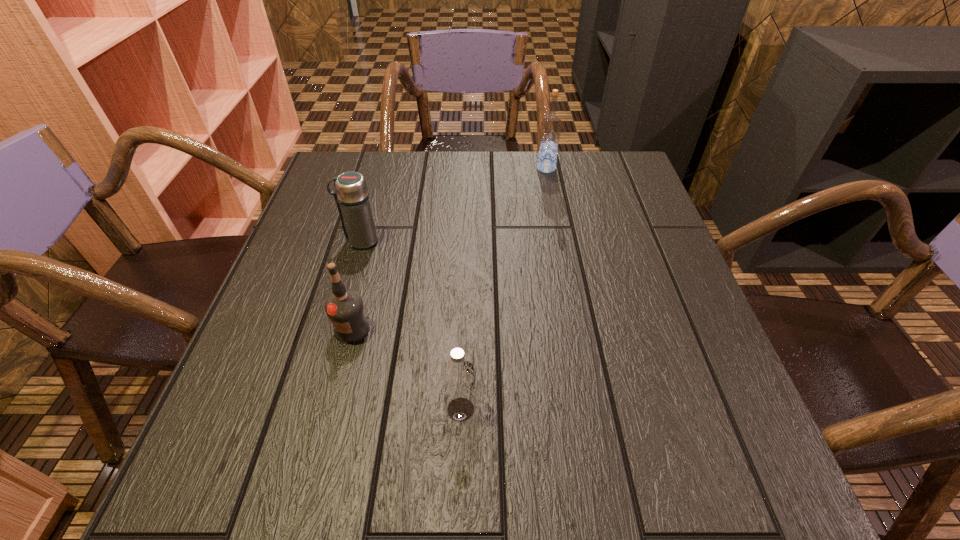
I want to click on vacant space situated 0.380m on the front label of the nearest vodka, so click(704, 409).

Where is `object at the far edge`? The width and height of the screenshot is (960, 540). object at the far edge is located at coordinates (550, 130).

The width and height of the screenshot is (960, 540). I want to click on thermos bottle positioned at the left edge, so click(351, 194).

Locate an element on the screen. vodka positioned at the left edge is located at coordinates (345, 308).

At what (x,y) coordinates should I click in order to perform the action: click on vacant space at the far edge of the desktop. Please return your answer as a coordinate pair (x, y). Looking at the image, I should click on (425, 188).

Image resolution: width=960 pixels, height=540 pixels. I want to click on free space at the near edge of the desktop, so click(520, 463).

Find the location of a particular element. The width and height of the screenshot is (960, 540). vacant space at the left edge of the desktop is located at coordinates (219, 432).

Where is `free space at the right edge`? free space at the right edge is located at coordinates (691, 305).

Image resolution: width=960 pixels, height=540 pixels. In the image, there is a desktop. Identify the location of vacant space at the far left corner. (382, 163).

This screenshot has height=540, width=960. I want to click on free space at the far right corner of the desktop, so click(x=636, y=184).